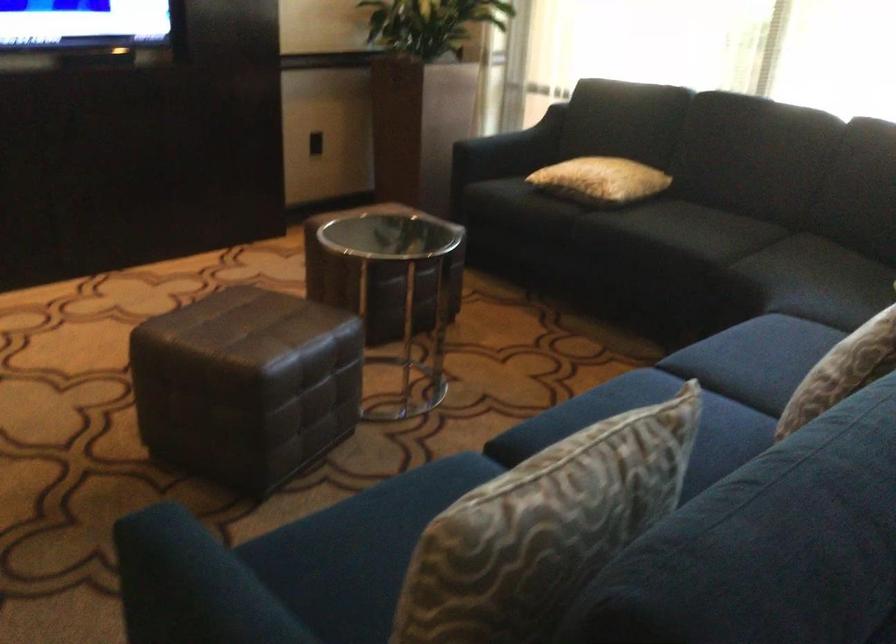
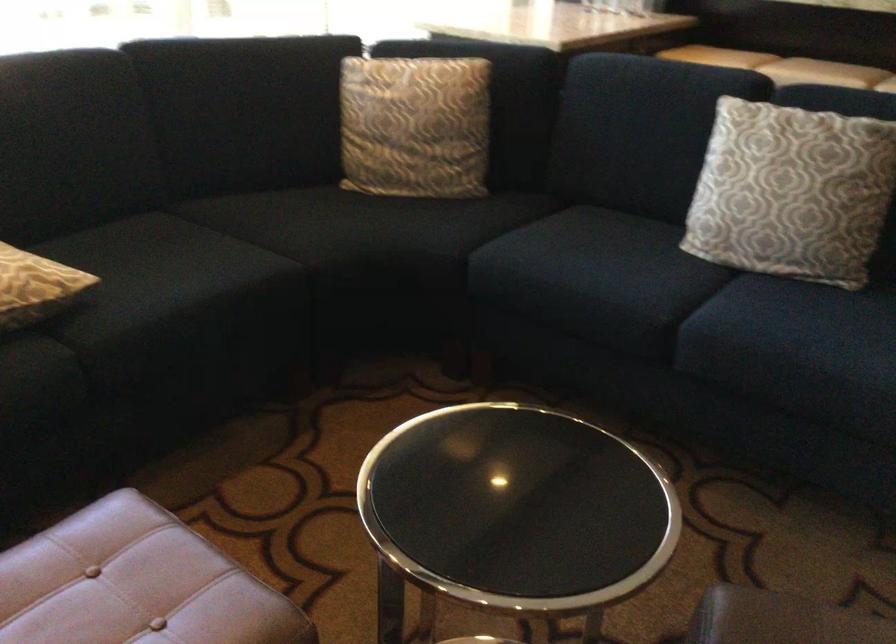
Find the pixel in the second image that matches (x=825, y=352) in the first image.

(791, 192)